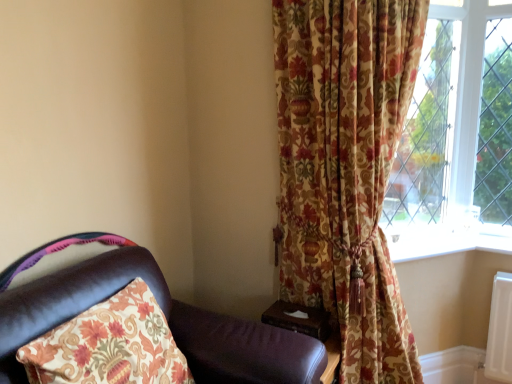
Where is `empty space that is ontop of white plastic window sill at lower right (from a real-world perspective)`? The height and width of the screenshot is (384, 512). empty space that is ontop of white plastic window sill at lower right (from a real-world perspective) is located at coordinates 428,238.